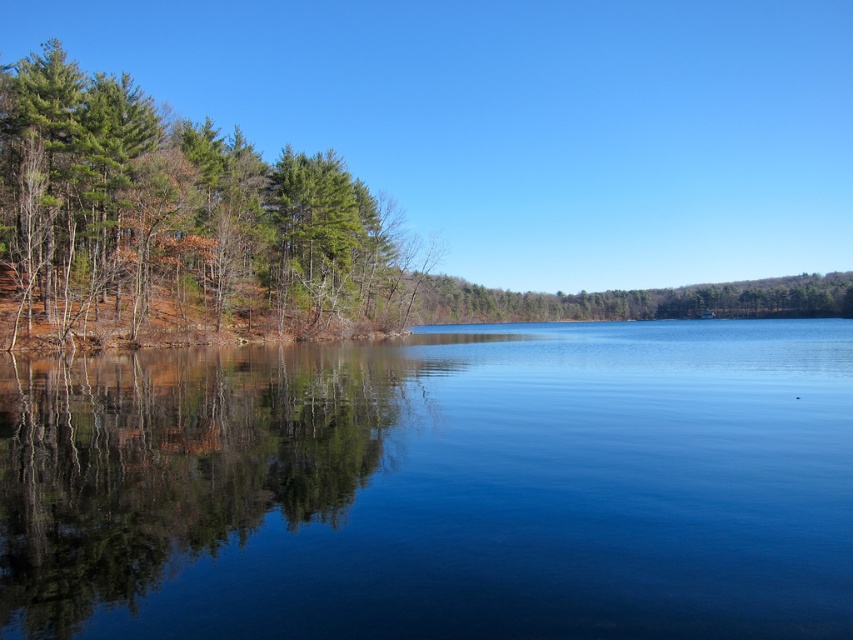
Does clear water at center have a greater width compared to green matte tree at left?

No.

Can you confirm if clear water at center is positioned to the right of green matte tree at left?

Correct, you'll find clear water at center to the right of green matte tree at left.

Which is in front, point (596, 380) or point (96, 266)?

Positioned in front is point (596, 380).

At what (x,y) coordinates should I click in order to perform the action: click on clear water at center. Please return your answer as a coordinate pair (x, y). Image resolution: width=853 pixels, height=640 pixels. Looking at the image, I should click on (436, 484).

Is green matte tree at left thinner than green matte trees at left?

Result: In fact, green matte tree at left might be wider than green matte trees at left.

Which is in front, point (61, 230) or point (244, 392)?

Point (244, 392) is in front.

Is point (368, 296) less distant than point (234, 403)?

No, it is not.

The height and width of the screenshot is (640, 853). Identify the location of green matte tree at left. (178, 225).

Between clear water at center and green matte trees at left, which one has less height?

Standing shorter between the two is green matte trees at left.

Who is more forward, (132, 492) or (132, 605)?

Point (132, 605)

Describe the element at coordinates (436, 484) in the screenshot. I see `clear water at center` at that location.

At what (x,y) coordinates should I click in order to perform the action: click on clear water at center. Please return your answer as a coordinate pair (x, y). This screenshot has width=853, height=640. Looking at the image, I should click on (436, 484).